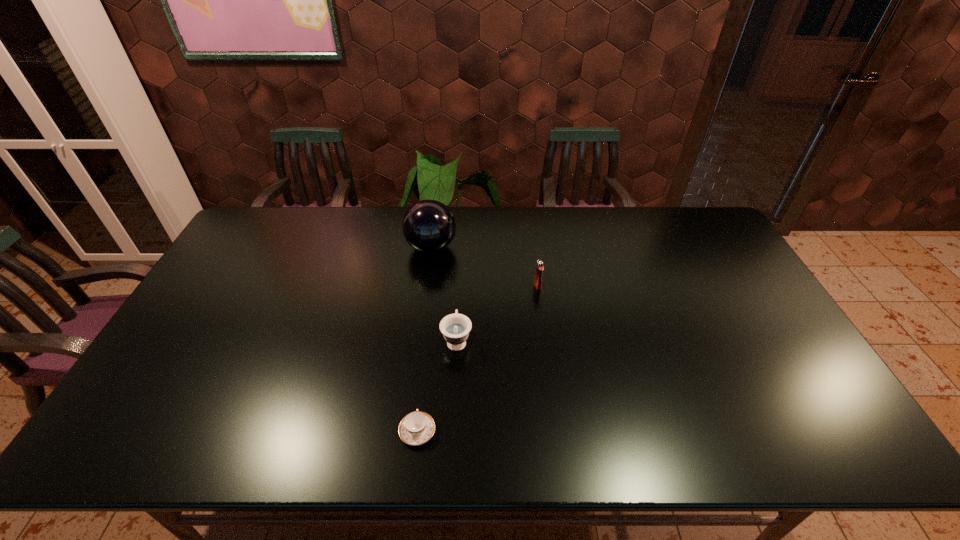
Locate an element on the screen. blank space that satisfies the following two spatial constraints: 1. on the side of the farthest object with the finger holes; 2. on the left side of the second farthest object is located at coordinates (426, 286).

This screenshot has width=960, height=540. What are the coordinates of `vacant position in the image that satisfies the following two spatial constraints: 1. on the side of the farthest object with the finger holes; 2. on the side of the taller teacup with the handle` in the screenshot? It's located at (420, 340).

Image resolution: width=960 pixels, height=540 pixels. What are the coordinates of `vacant space that satisfies the following two spatial constraints: 1. on the side with the handle of the nearest object; 2. on the side of the bowling ball with the finger holes` in the screenshot? It's located at (438, 247).

Identify the location of blank area in the image that satisfies the following two spatial constraints: 1. on the side with the handle of the nearest object; 2. on the left side of the igniter. The width and height of the screenshot is (960, 540). (434, 286).

The image size is (960, 540). I want to click on free space that satisfies the following two spatial constraints: 1. on the side with the handle of the nearer teacup; 2. on the side of the tallest object with the finger holes, so click(438, 247).

The width and height of the screenshot is (960, 540). What are the coordinates of `free space in the image that satisfies the following two spatial constraints: 1. on the side of the farthest object with the finger holes; 2. on the side with the handle of the shortest object` in the screenshot? It's located at (408, 431).

The height and width of the screenshot is (540, 960). Identify the location of vacant space that satisfies the following two spatial constraints: 1. on the side of the bowling ball with the finger holes; 2. on the side of the third farthest object with the handle. (420, 340).

This screenshot has width=960, height=540. What are the coordinates of `free location that satisfies the following two spatial constraints: 1. on the side of the farthest object with the finger holes; 2. on the left side of the rightmost object` in the screenshot? It's located at (426, 286).

At what (x,y) coordinates should I click in order to perform the action: click on vacant space that satisfies the following two spatial constraints: 1. on the side of the bowling ball with the finger holes; 2. on the side with the handle of the shortest object. Please return your answer as a coordinate pair (x, y). Looking at the image, I should click on tap(408, 431).